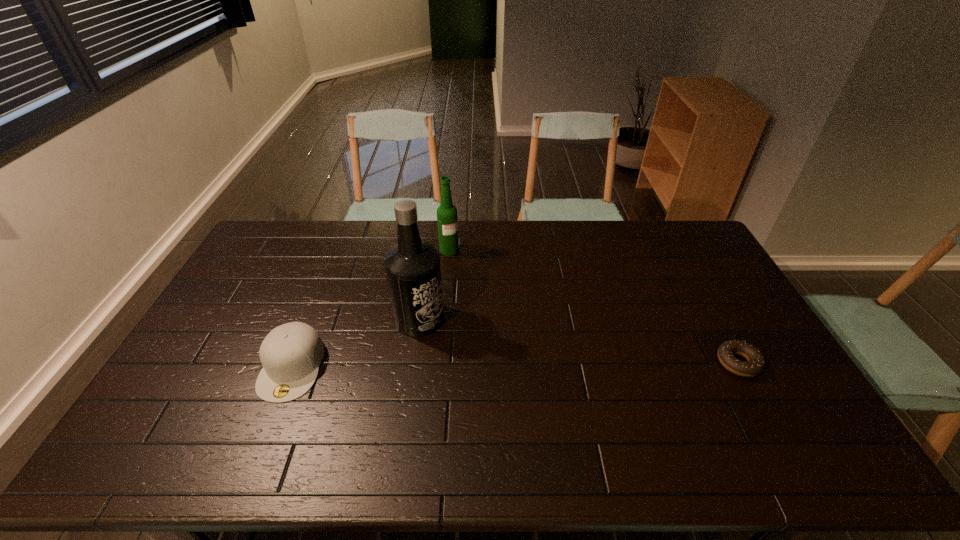
Find the location of a particular element. Image resolution: width=960 pixels, height=540 pixels. the third tallest object is located at coordinates (291, 354).

This screenshot has width=960, height=540. Identify the location of the leftmost object. (291, 354).

The image size is (960, 540). What are the coordinates of `the shortest object` in the screenshot? It's located at (756, 363).

Find the location of a particular element. the rightmost object is located at coordinates (756, 363).

I want to click on the tallest object, so click(x=412, y=267).

The height and width of the screenshot is (540, 960). In order to click on the farthest object in this screenshot , I will do `click(447, 221)`.

Where is `the second tallest object`? The height and width of the screenshot is (540, 960). the second tallest object is located at coordinates (447, 221).

This screenshot has width=960, height=540. I want to click on vacant region located 0.050m on the front-facing side of the cap, so click(x=271, y=420).

Find the location of a particular element. This screenshot has height=540, width=960. vacant space located 0.390m on the back of the rightmost object is located at coordinates (684, 263).

Locate an element on the screen. vacant area situated 0.300m on the front label of the liquor is located at coordinates [x=528, y=368].